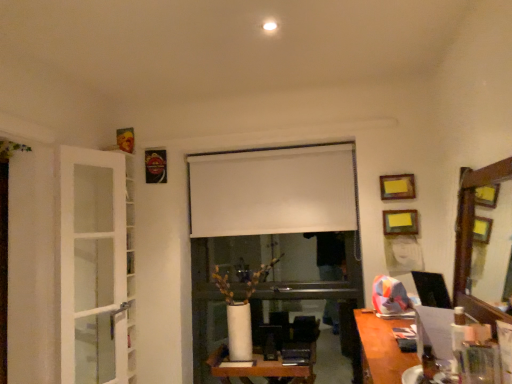
Question: Does white matte window screen at center have a greater height compared to wooden framed mirror at right?

Choices:
 (A) no
 (B) yes

Answer: (A)

Question: Is white matte window screen at center oriented away from wooden framed mirror at right?

Choices:
 (A) no
 (B) yes

Answer: (A)

Question: From a real-world perspective, is white matte window screen at center located higher than wooden framed mirror at right?

Choices:
 (A) no
 (B) yes

Answer: (B)

Question: From the image's perspective, does white matte window screen at center appear lower than wooden framed mirror at right?

Choices:
 (A) no
 (B) yes

Answer: (A)

Question: From the image's perspective, is white matte window screen at center above wooden framed mirror at right?

Choices:
 (A) no
 (B) yes

Answer: (B)

Question: From a real-world perspective, is white glossy table at center, the 1th table viewed from the back, positioned above or below wooden desk at lower right, arranged as the 2th table when ordered from the bottom?

Choices:
 (A) below
 (B) above

Answer: (A)

Question: Is white glossy table at center, the second table from the top, situated inside wooden desk at lower right, the 2th table in the left-to-right sequence, or outside?

Choices:
 (A) inside
 (B) outside

Answer: (B)

Question: Would you say white glossy table at center, the 1th table viewed from the back, is to the left or to the right of wooden desk at lower right, the 2th table in the left-to-right sequence, in the picture?

Choices:
 (A) right
 (B) left

Answer: (B)

Question: Is white glossy table at center, the first table in the bottom-to-top sequence, wider or thinner than wooden desk at lower right, which appears as the 1th table when viewed from the front?

Choices:
 (A) wide
 (B) thin

Answer: (B)

Question: Considering the positions of white matte window screen at center and metallic gold picture frame at upper left, which is counted as the third picture frame, starting from the front, in the image, is white matte window screen at center bigger or smaller than metallic gold picture frame at upper left, which is counted as the third picture frame, starting from the front,?

Choices:
 (A) big
 (B) small

Answer: (A)

Question: Which is correct: white matte window screen at center is inside metallic gold picture frame at upper left, which is counted as the third picture frame, starting from the front, or outside of it?

Choices:
 (A) inside
 (B) outside

Answer: (B)

Question: Considering the positions of white matte window screen at center and metallic gold picture frame at upper left, acting as the first picture frame starting from the left, in the image, is white matte window screen at center taller or shorter than metallic gold picture frame at upper left, acting as the first picture frame starting from the left,?

Choices:
 (A) tall
 (B) short

Answer: (A)

Question: From the image's perspective, is white matte window screen at center above or below metallic gold picture frame at upper left, the third picture frame from the bottom?

Choices:
 (A) above
 (B) below

Answer: (B)

Question: Is point (373, 360) positioned closer to the camera than point (400, 210)?

Choices:
 (A) closer
 (B) farther

Answer: (A)

Question: Is wooden desk at lower right, the first table viewed from the right, in front of or behind yellow paper at upper right, the 1th picture frame in the right-to-left sequence, in the image?

Choices:
 (A) behind
 (B) front

Answer: (B)